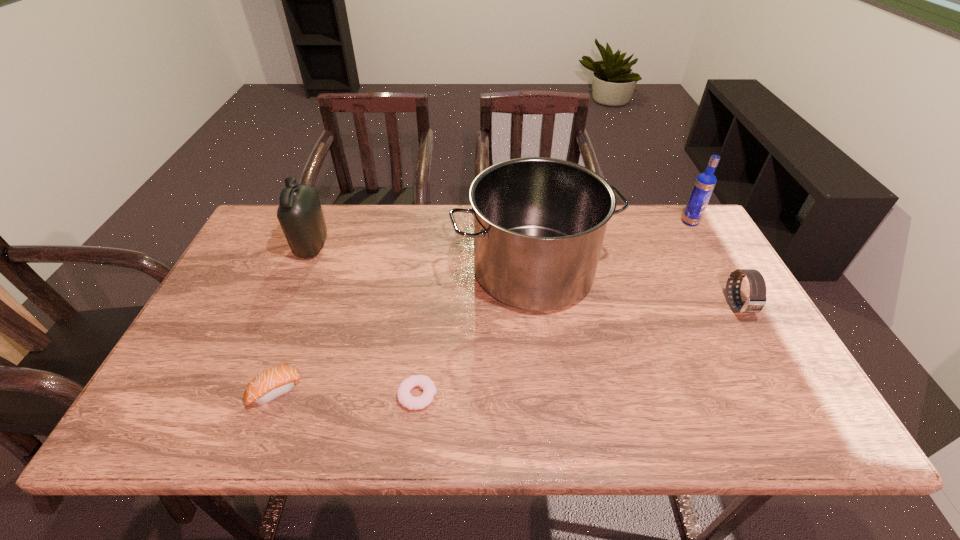
The height and width of the screenshot is (540, 960). I want to click on the third object from right to left, so click(539, 223).

In order to click on bottle in this screenshot , I will do `click(299, 213)`.

Find the location of a particular element. This screenshot has width=960, height=540. vodka is located at coordinates (704, 185).

Find the location of `the third shortest object`. the third shortest object is located at coordinates (756, 301).

The image size is (960, 540). Find the location of `the second shortest object`. the second shortest object is located at coordinates (269, 385).

Find the location of a particular element. the shortest object is located at coordinates (405, 398).

Find the location of a particular element. This screenshot has width=960, height=540. the fourth object from right to left is located at coordinates (405, 398).

The image size is (960, 540). What are the coordinates of `free space located on the front of the saucepan` in the screenshot? It's located at (543, 347).

This screenshot has height=540, width=960. What are the coordinates of `vacant space located 0.110m on the right of the bottle` in the screenshot? It's located at (364, 246).

The width and height of the screenshot is (960, 540). Identify the location of free spot located on the front of the farthest object. (708, 254).